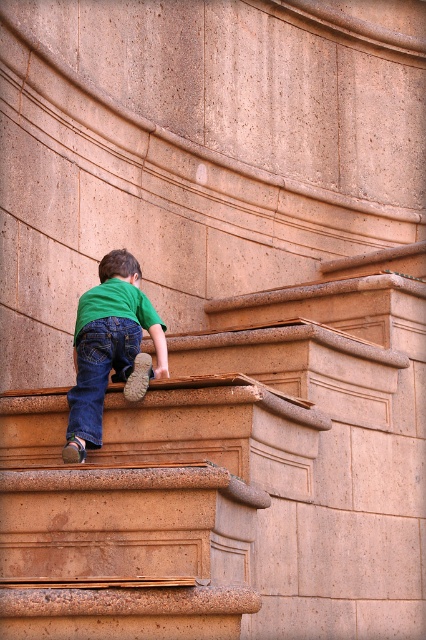
Question: Can you confirm if brown stone stairs at center is smaller than denim/jeans at lower left?

Choices:
 (A) no
 (B) yes

Answer: (A)

Question: Which point is farther from the camera taking this photo?

Choices:
 (A) [94, 342]
 (B) [28, 524]
 (C) [92, 401]

Answer: (A)

Question: Estimate the real-world distances between objects in this image. Which object is farther from the denim/jeans at lower left?

Choices:
 (A) green matte shirt at upper center
 (B) brown stone stairs at center

Answer: (B)

Question: Which of the following is the closest to the observer?

Choices:
 (A) brown stone stairs at center
 (B) denim/jeans at lower left

Answer: (A)

Question: Is brown stone stairs at center to the left of green matte shirt at upper center from the viewer's perspective?

Choices:
 (A) no
 (B) yes

Answer: (A)

Question: Observing the image, what is the correct spatial positioning of brown stone stairs at center in reference to denim/jeans at lower left?

Choices:
 (A) below
 (B) above

Answer: (A)